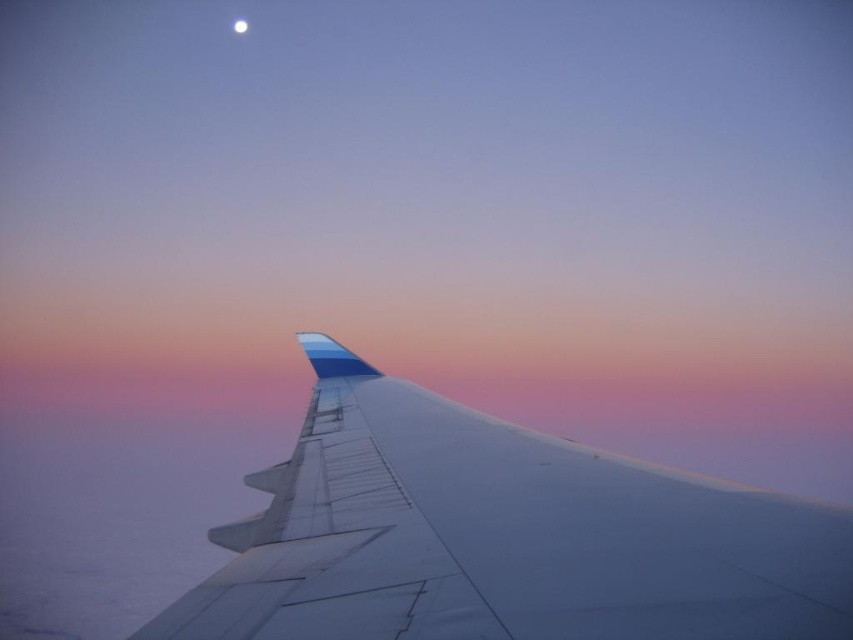
Can you confirm if white matte airplane wing at center is smaller than white glossy moon at upper center?

Indeed, white matte airplane wing at center has a smaller size compared to white glossy moon at upper center.

Who is taller, white matte airplane wing at center or white glossy moon at upper center?

Standing taller between the two is white glossy moon at upper center.

Measure the distance between point (415,563) and camera.

A distance of 5.24 feet exists between point (415,563) and camera.

Where is `white matte airplane wing at center`? white matte airplane wing at center is located at coordinates (502, 536).